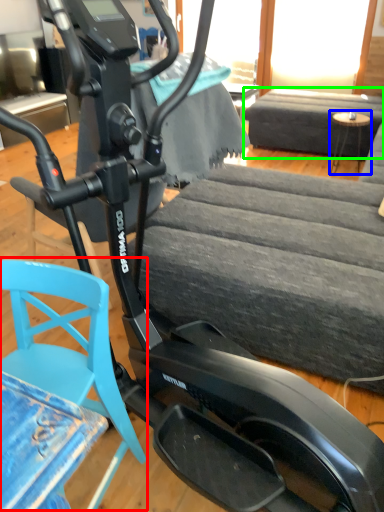
Question: Which object is the farthest from swivel chair (highlighted by a red box)? Choose among these: table (highlighted by a blue box) or couch (highlighted by a green box).

Choices:
 (A) table
 (B) couch

Answer: (B)